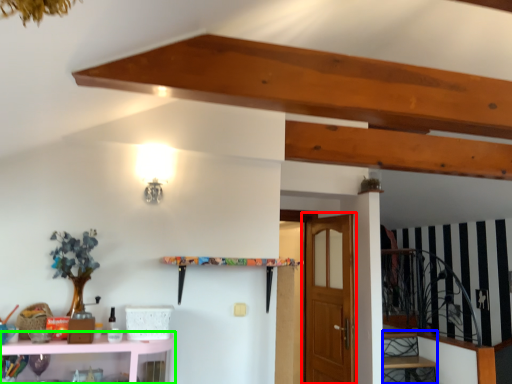
Question: Which object is positioned closest to door (highlighted by a red box)? Select from stairwell (highlighted by a blue box) and shelf (highlighted by a green box).

Choices:
 (A) stairwell
 (B) shelf

Answer: (A)